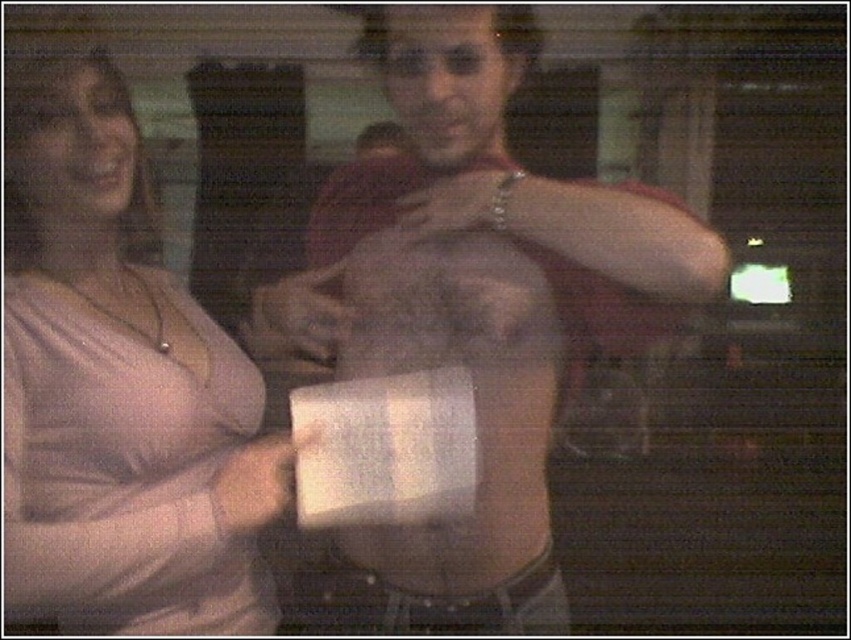
Between matte gray shirt at center and white matte paper at center, which one is positioned lower?

Positioned lower is white matte paper at center.

Does matte gray shirt at center have a lesser width compared to white matte paper at center?

No.

Is point (364, 285) farther from viewer compared to point (250, 476)?

Yes, it is.

The image size is (851, 640). I want to click on matte gray shirt at center, so click(480, 301).

From the picture: Which is more to the left, white matte paper at center or smooth skin hand at center?

white matte paper at center is more to the left.

Does point (266, 472) lie behind point (473, 208)?

Yes, point (266, 472) is farther from viewer.

This screenshot has width=851, height=640. What are the coordinates of `white matte paper at center` in the screenshot? It's located at (254, 484).

Is pink matte shirt at left taller than white matte paper at center?

Correct, pink matte shirt at left is much taller as white matte paper at center.

Find the location of a particular element. pink matte shirt at left is located at coordinates (111, 387).

The width and height of the screenshot is (851, 640). Identify the location of pink matte shirt at left. (111, 387).